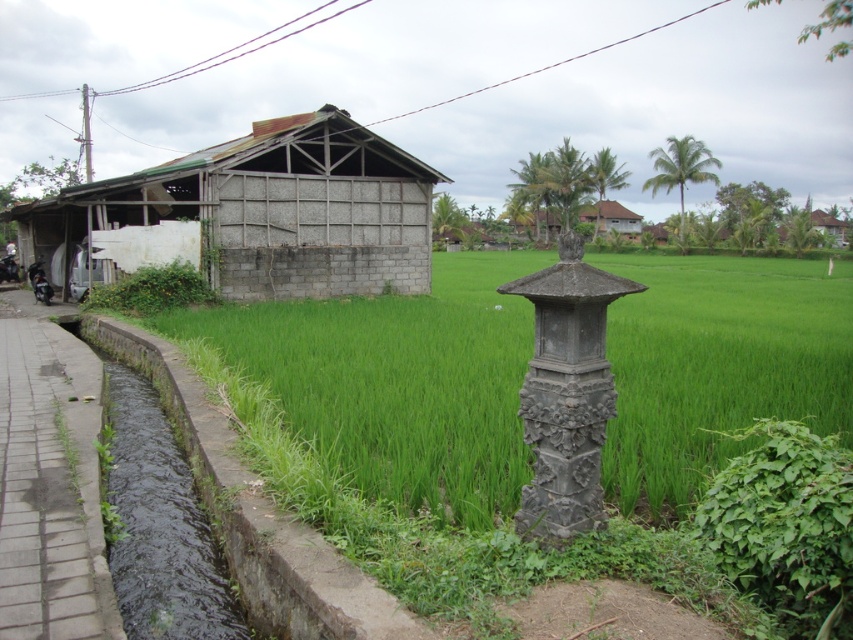
Question: Can you confirm if dark gray concrete at left is bigger than brown thatched roof hut at center?

Choices:
 (A) no
 (B) yes

Answer: (A)

Question: Which object is positioned closest to the dark gray stone pillar at center-right?

Choices:
 (A) dark gray concrete at left
 (B) brick paved path at lower left
 (C) wooden hut at upper right
 (D) rusty corrugated metal hut at left

Answer: (A)

Question: Which point is closer to the camera taking this photo?

Choices:
 (A) (621, 218)
 (B) (785, 214)

Answer: (A)

Question: Can you confirm if dark gray concrete at left is wider than brown thatched roof hut at center?

Choices:
 (A) no
 (B) yes

Answer: (A)

Question: Which object is farther from the camera taking this photo?

Choices:
 (A) dark gray concrete at left
 (B) dark gray stone pillar at center-right

Answer: (A)

Question: In this image, where is brick paved path at lower left located relative to brown thatched roof hut at center?

Choices:
 (A) below
 (B) above

Answer: (A)